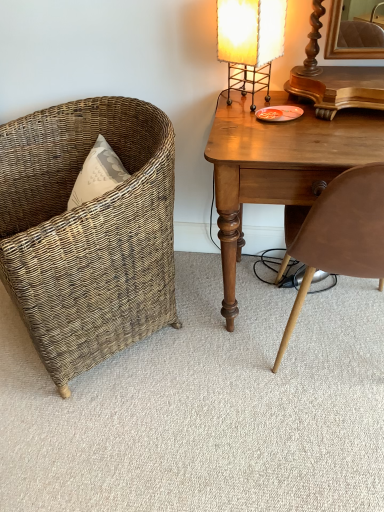
This screenshot has width=384, height=512. In order to click on free space that is in between brown leather chair at right, the 2th chair in the left-to-right sequence, and wooden desk at right in this screenshot , I will do `click(256, 358)`.